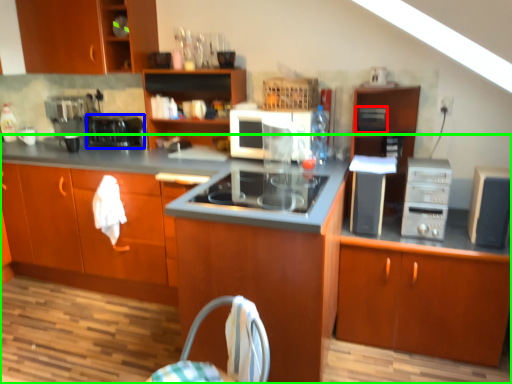
Question: Which object is the farthest from appliance (highlighted by a red box)? Choose among these: kitchen appliance (highlighted by a blue box) or cabinetry (highlighted by a green box).

Choices:
 (A) kitchen appliance
 (B) cabinetry

Answer: (A)